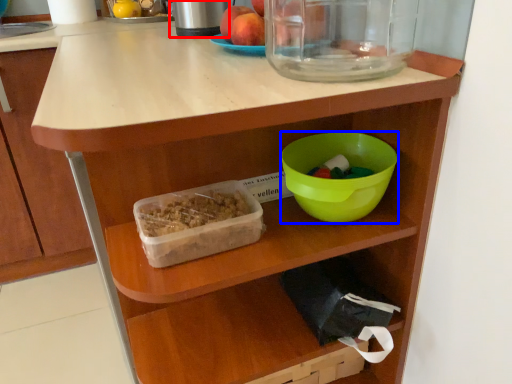
Question: Which object is closer to the camera taking this photo, appliance (highlighted by a red box) or bowl (highlighted by a blue box)?

Choices:
 (A) appliance
 (B) bowl

Answer: (B)